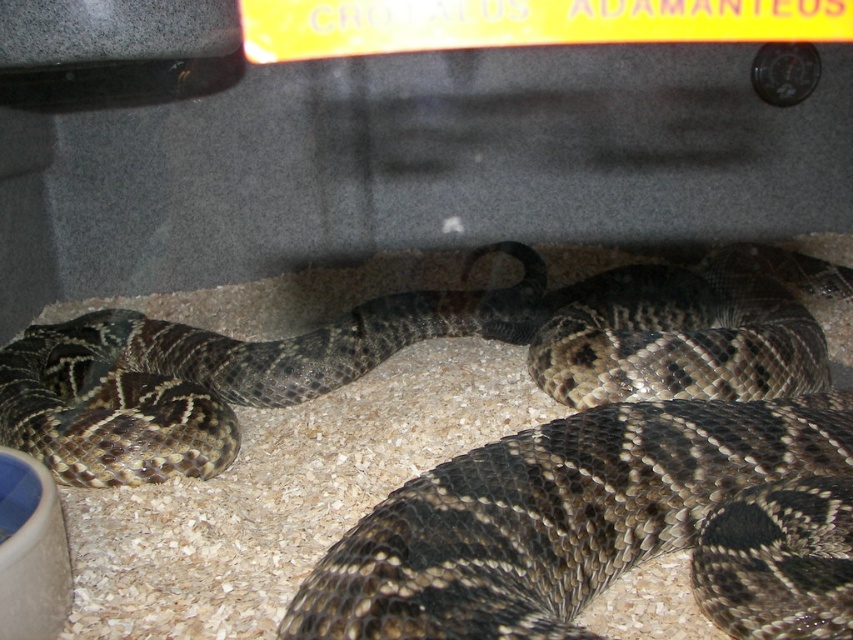
Is shiny brown snake at center taller than brown speckled snake at center?

Yes.

Does shiny brown snake at center have a larger size compared to brown speckled snake at center?

Yes.

Is point (691, 404) less distant than point (199, 412)?

Yes, it is in front of point (199, 412).

The height and width of the screenshot is (640, 853). I want to click on shiny brown snake at center, so click(595, 449).